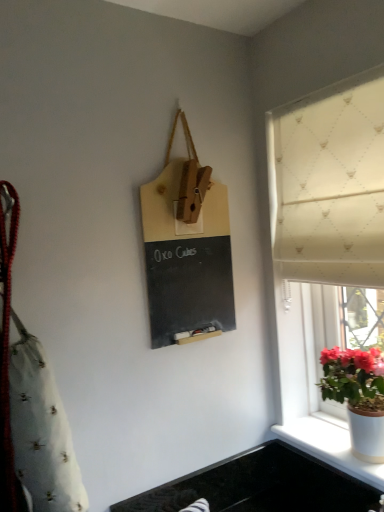
Question: Does white ceramic pot at lower right come in front of white glossy pot at window?

Choices:
 (A) yes
 (B) no

Answer: (B)

Question: Is white ceramic pot at lower right wider than white glossy pot at window?

Choices:
 (A) yes
 (B) no

Answer: (B)

Question: Is white ceramic pot at lower right outside of white glossy pot at window?

Choices:
 (A) yes
 (B) no

Answer: (A)

Question: Is white ceramic pot at lower right shorter than white glossy pot at window?

Choices:
 (A) yes
 (B) no

Answer: (A)

Question: Considering the relative sizes of white ceramic pot at lower right and white glossy pot at window in the image provided, is white ceramic pot at lower right thinner than white glossy pot at window?

Choices:
 (A) no
 (B) yes

Answer: (B)

Question: From a real-world perspective, is white ceramic pot at lower right physically located above or below black granite sink at lower center?

Choices:
 (A) above
 (B) below

Answer: (A)

Question: Is white ceramic pot at lower right in front of or behind black granite sink at lower center in the image?

Choices:
 (A) behind
 (B) front

Answer: (B)

Question: In terms of size, does white ceramic pot at lower right appear bigger or smaller than black granite sink at lower center?

Choices:
 (A) small
 (B) big

Answer: (A)

Question: Would you say white ceramic pot at lower right is inside or outside black granite sink at lower center?

Choices:
 (A) inside
 (B) outside

Answer: (B)

Question: Considering the positions of white textured fabric at right and matte wood chalkboard at center in the image, is white textured fabric at right taller or shorter than matte wood chalkboard at center?

Choices:
 (A) tall
 (B) short

Answer: (A)

Question: In terms of width, does white textured fabric at right look wider or thinner when compared to matte wood chalkboard at center?

Choices:
 (A) thin
 (B) wide

Answer: (B)

Question: Is white textured fabric at right in front of or behind matte wood chalkboard at center in the image?

Choices:
 (A) behind
 (B) front

Answer: (B)

Question: Visually, is white textured fabric at right positioned to the left or to the right of matte wood chalkboard at center?

Choices:
 (A) left
 (B) right

Answer: (B)

Question: Looking at their shapes, would you say matte wood chalkboard at center is wider or thinner than black granite sink at lower center?

Choices:
 (A) thin
 (B) wide

Answer: (A)

Question: Considering the relative positions of matte wood chalkboard at center and black granite sink at lower center in the image provided, is matte wood chalkboard at center to the left or to the right of black granite sink at lower center?

Choices:
 (A) left
 (B) right

Answer: (A)